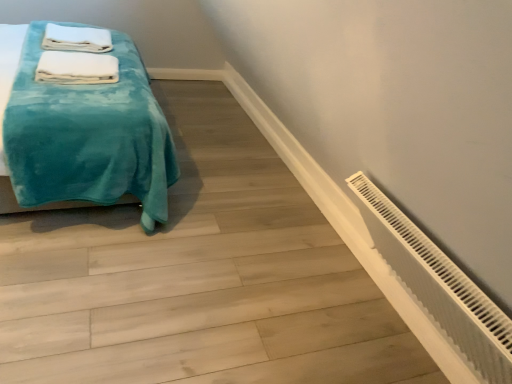
Question: Would you say white plastic radiator at lower right is inside or outside teal plush blanket at left?

Choices:
 (A) inside
 (B) outside

Answer: (B)

Question: Considering the positions of white plastic radiator at lower right and teal plush blanket at left in the image, is white plastic radiator at lower right wider or thinner than teal plush blanket at left?

Choices:
 (A) wide
 (B) thin

Answer: (A)

Question: Which of these objects is positioned farthest from the teal plush blanket at left?

Choices:
 (A) white soft towel at upper left, positioned as the 2th bath towel in front-to-back order
 (B) white plastic radiator at lower right
 (C) white soft towel at upper left, the first bath towel ordered from the bottom

Answer: (B)

Question: Which is farther from the white soft towel at upper left, positioned as the 2th bath towel in front-to-back order?

Choices:
 (A) white soft towel at upper left, the 2th bath towel when ordered from top to bottom
 (B) teal plush blanket at left
 (C) white plastic radiator at lower right

Answer: (C)